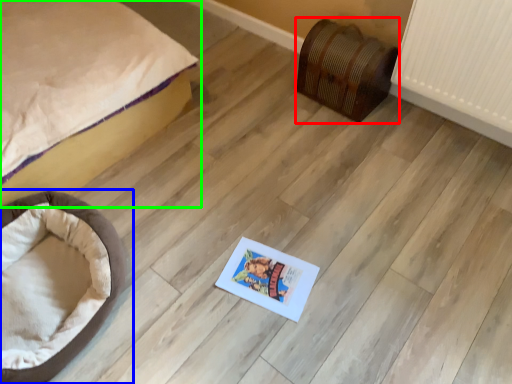
Question: Based on their relative distances, which object is farther from furniture (highlighted by a red box)? Choose from dog bed (highlighted by a blue box) and bed (highlighted by a green box).

Choices:
 (A) dog bed
 (B) bed

Answer: (A)